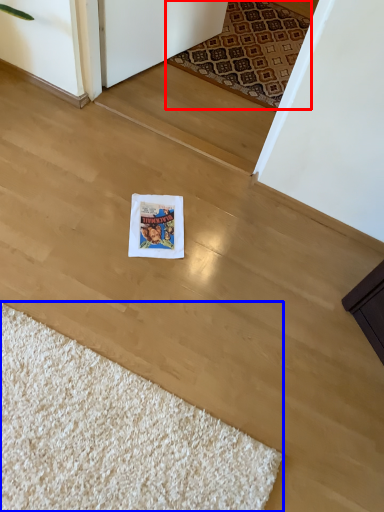
Question: Which point is closer to the camera, mat (highlighted by a red box) or doormat (highlighted by a blue box)?

Choices:
 (A) mat
 (B) doormat

Answer: (B)